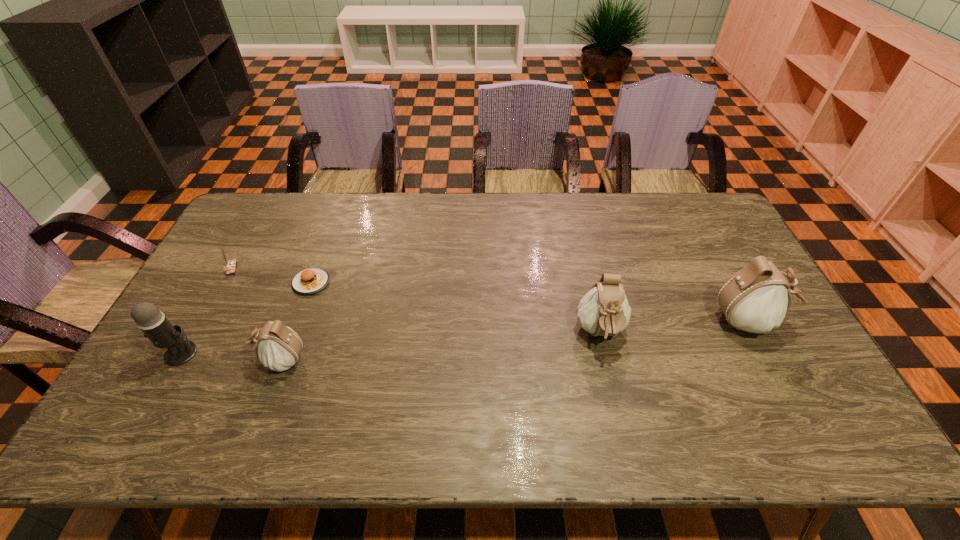
Locate an element on the screen. The width and height of the screenshot is (960, 540). free spot that satisfies the following two spatial constraints: 1. on the back side of the second shortest object; 2. on the left side of the microphone is located at coordinates (228, 269).

This screenshot has width=960, height=540. What are the coordinates of `free space that satisfies the following two spatial constraints: 1. on the front-facing side of the rightmost object; 2. on the front side of the microphone` in the screenshot? It's located at point(765,353).